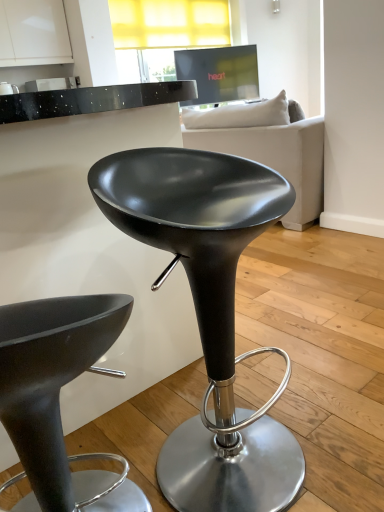
What is the approximate height of matte black stool at center, the 1th stool positioned from the left?

matte black stool at center, the 1th stool positioned from the left, is 61.02 centimeters in height.

The height and width of the screenshot is (512, 384). In order to click on matte black stool at center, acting as the 2th stool starting from the left in this screenshot , I will do `click(209, 314)`.

From the image's perspective, would you say white fabric couch at upper center is shown under matte black stool at center, the 1th stool positioned from the right?

No, from the image's perspective, white fabric couch at upper center is not beneath matte black stool at center, the 1th stool positioned from the right.

In the scene shown: Which object is wider, white fabric couch at upper center or matte black stool at center, the 1th stool positioned from the right?

Wider between the two is white fabric couch at upper center.

Is white fabric couch at upper center far away from matte black stool at center, the 1th stool positioned from the right?

Yes, white fabric couch at upper center and matte black stool at center, the 1th stool positioned from the right, are located far from each other.

Locate an element on the screen. This screenshot has height=512, width=384. studio couch above the matte black stool at center, acting as the 2th stool starting from the left (from a real-world perspective) is located at coordinates click(x=268, y=149).

Does matte black stool at center, which appears as the 2th stool when viewed from the right, contain matte black stool at center, the 1th stool positioned from the right?

No.

Could you measure the distance between matte black stool at center, the 1th stool positioned from the left, and matte black stool at center, acting as the 2th stool starting from the left?

matte black stool at center, the 1th stool positioned from the left, and matte black stool at center, acting as the 2th stool starting from the left, are 25.03 centimeters apart.

From the image's perspective, is matte black stool at center, the 1th stool positioned from the left, under matte black stool at center, the 1th stool positioned from the right?

Correct, matte black stool at center, the 1th stool positioned from the left, appears lower than matte black stool at center, the 1th stool positioned from the right, in the image.

The width and height of the screenshot is (384, 512). What are the coordinates of `stool that is on the left side of matte black stool at center, acting as the 2th stool starting from the left` in the screenshot? It's located at (58, 399).

In the scene shown: From a real-world perspective, is matte black stool at center, the 1th stool positioned from the left, positioned under white fabric couch at upper center based on gravity?

Yes, from a real-world perspective, matte black stool at center, the 1th stool positioned from the left, is beneath white fabric couch at upper center.

Which of these two, matte black stool at center, which appears as the 2th stool when viewed from the right, or white fabric couch at upper center, stands shorter?

Standing shorter between the two is matte black stool at center, which appears as the 2th stool when viewed from the right.

Which is behind, point (20, 362) or point (264, 140)?

The point (264, 140) is farther.

Does matte black stool at center, the 1th stool positioned from the left, come behind white fabric couch at upper center?

No, matte black stool at center, the 1th stool positioned from the left, is in front of white fabric couch at upper center.

Which is closer to the camera, [181,469] or [271,142]?

Point [181,469].

What's the angular difference between matte black stool at center, acting as the 2th stool starting from the left, and white fabric couch at upper center's facing directions?

68 degrees separate the facing orientations of matte black stool at center, acting as the 2th stool starting from the left, and white fabric couch at upper center.

Can you confirm if matte black stool at center, acting as the 2th stool starting from the left, is shorter than white fabric couch at upper center?

Yes.

Is matte black stool at center, the 1th stool positioned from the right, turned away from white fabric couch at upper center?

No, matte black stool at center, the 1th stool positioned from the right, is not facing away from white fabric couch at upper center.

From the image's perspective, does matte black stool at center, acting as the 2th stool starting from the left, appear lower than matte black stool at center, the 1th stool positioned from the left?

No.

Find the location of a particular element. stool in front of the matte black stool at center, acting as the 2th stool starting from the left is located at coordinates (58, 399).

Is matte black stool at center, which appears as the 2th stool when viewed from the right, located within matte black stool at center, acting as the 2th stool starting from the left?

That's incorrect, matte black stool at center, which appears as the 2th stool when viewed from the right, is not inside matte black stool at center, acting as the 2th stool starting from the left.

Considering the points (315, 130) and (126, 316), which point is behind, point (315, 130) or point (126, 316)?

Positioned behind is point (315, 130).

Could you measure the distance between white fabric couch at upper center and matte black stool at center, which appears as the 2th stool when viewed from the right?

They are 6.75 feet apart.

Looking at their sizes, would you say white fabric couch at upper center is wider or thinner than matte black stool at center, the 1th stool positioned from the left?

Considering their sizes, white fabric couch at upper center looks broader than matte black stool at center, the 1th stool positioned from the left.

From the image's perspective, starting from the white fabric couch at upper center, which stool is the 1st one below? Please provide its 2D coordinates.

[(209, 314)]

Identify the location of stool located above the matte black stool at center, which appears as the 2th stool when viewed from the right (from the image's perspective). Image resolution: width=384 pixels, height=512 pixels. (209, 314).

Estimate the real-world distances between objects in this image. Which object is further from matte black stool at center, the 1th stool positioned from the left, matte black stool at center, acting as the 2th stool starting from the left, or white fabric couch at upper center?

Based on the image, white fabric couch at upper center appears to be further to matte black stool at center, the 1th stool positioned from the left.

From the image, which object appears to be nearer to white fabric couch at upper center, matte black stool at center, which appears as the 2th stool when viewed from the right, or matte black stool at center, the 1th stool positioned from the right?

matte black stool at center, the 1th stool positioned from the right.

Looking at the image, which one is located closer to matte black stool at center, acting as the 2th stool starting from the left, matte black stool at center, the 1th stool positioned from the left, or white fabric couch at upper center?

matte black stool at center, the 1th stool positioned from the left, is closer to matte black stool at center, acting as the 2th stool starting from the left.

Considering their positions, is white fabric couch at upper center positioned closer to matte black stool at center, the 1th stool positioned from the right, than matte black stool at center, the 1th stool positioned from the left?

matte black stool at center, the 1th stool positioned from the left.

Which object lies nearer to the anchor point matte black stool at center, the 1th stool positioned from the left, white fabric couch at upper center or matte black stool at center, the 1th stool positioned from the right?

matte black stool at center, the 1th stool positioned from the right, is positioned closer to the anchor matte black stool at center, the 1th stool positioned from the left.

From the image, which object appears to be farther from white fabric couch at upper center, matte black stool at center, acting as the 2th stool starting from the left, or matte black stool at center, which appears as the 2th stool when viewed from the right?

Based on the image, matte black stool at center, which appears as the 2th stool when viewed from the right, appears to be further to white fabric couch at upper center.

This screenshot has height=512, width=384. In order to click on stool between matte black stool at center, which appears as the 2th stool when viewed from the right, and white fabric couch at upper center from front to back in this screenshot , I will do `click(209, 314)`.